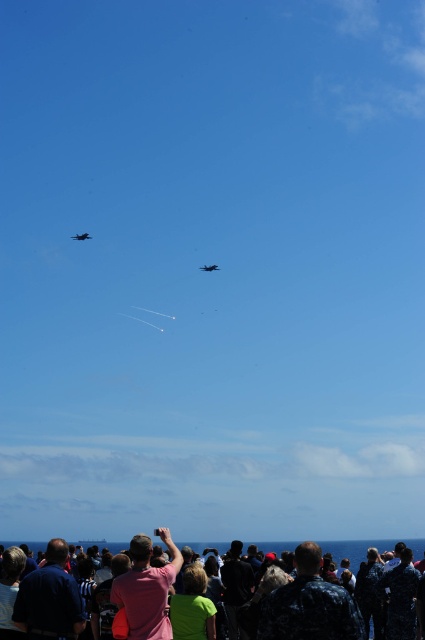
Is dark blue shirt at lower left further to camera compared to navy uniform at lower right?

That is False.

Who is positioned more to the right, dark blue shirt at lower left or navy uniform at lower right?

navy uniform at lower right is more to the right.

Measure the distance between dark blue shirt at lower left and camera.

dark blue shirt at lower left and camera are 208.03 feet apart from each other.

Identify the location of dark blue shirt at lower left. (50, 598).

Does navy blue uniform at lower center appear on the left side of shiny silver airplane at upper center?

No, navy blue uniform at lower center is not to the left of shiny silver airplane at upper center.

Is the position of navy blue uniform at lower center more distant than that of shiny silver airplane at upper center?

No, it is in front of shiny silver airplane at upper center.

Where is `navy blue uniform at lower center`? navy blue uniform at lower center is located at coordinates (309, 604).

Can you confirm if navy blue uniform at lower center is shorter than shiny dark blue jet at center?

No, navy blue uniform at lower center is not shorter than shiny dark blue jet at center.

Does navy blue uniform at lower center have a greater height compared to shiny dark blue jet at center?

Yes, navy blue uniform at lower center is taller than shiny dark blue jet at center.

Is point (314, 560) behind point (207, 266)?

That is False.

Find the location of `navy blue uniform at lower center`. navy blue uniform at lower center is located at coordinates (309, 604).